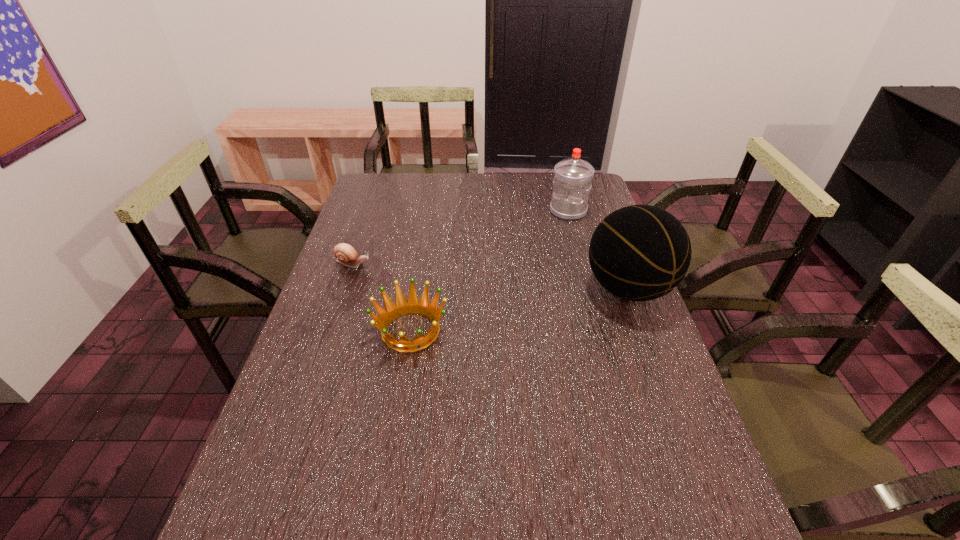
Find the location of a particular element. vacant space situated on the handle side of the farthest object is located at coordinates (554, 232).

The image size is (960, 540). I want to click on blank space located 0.280m on the front-facing side of the escargot, so click(x=456, y=282).

You are a GUI agent. You are given a task and a screenshot of the screen. Output one action in this format:
    pyautogui.click(x=<x>, y=<y>)
    Task: Click on the vacant space located 0.230m on the front-facing side of the escargot
    The width and height of the screenshot is (960, 540).
    Given the screenshot: What is the action you would take?
    pyautogui.click(x=440, y=279)

I want to click on vacant space situated 0.160m on the front-facing side of the escargot, so click(x=419, y=274).

In order to click on object at the far edge in this screenshot , I will do `click(572, 181)`.

Where is `object situated at the left edge`? This screenshot has width=960, height=540. object situated at the left edge is located at coordinates (345, 253).

Where is `basketball positioned at the right edge`? The height and width of the screenshot is (540, 960). basketball positioned at the right edge is located at coordinates [640, 252].

You are a GUI agent. You are given a task and a screenshot of the screen. Output one action in this format:
    pyautogui.click(x=<x>, y=<y>)
    Task: Click on the water bottle that is at the right edge
    
    Given the screenshot: What is the action you would take?
    pyautogui.click(x=572, y=181)

I want to click on object that is at the far right corner, so (572, 181).

Image resolution: width=960 pixels, height=540 pixels. I want to click on blank space at the far edge, so click(404, 201).